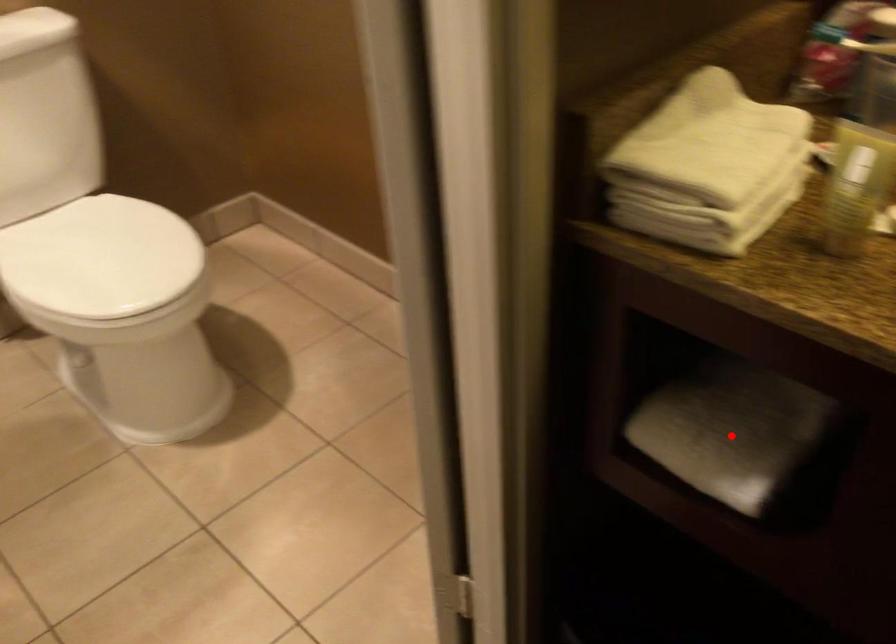
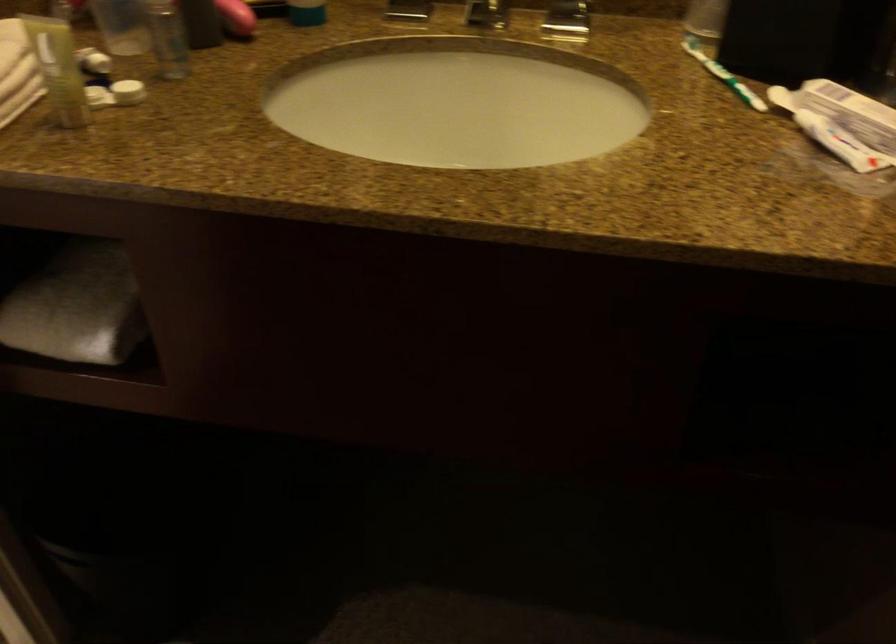
Question: I am providing you with two images of the same scene from different viewpoints. Image1 has a red point marked. In image2, the corresponding 3D location appears at what relative position? Reply with the corresponding letter.

Choices:
 (A) Closer
 (B) Farther

Answer: (B)